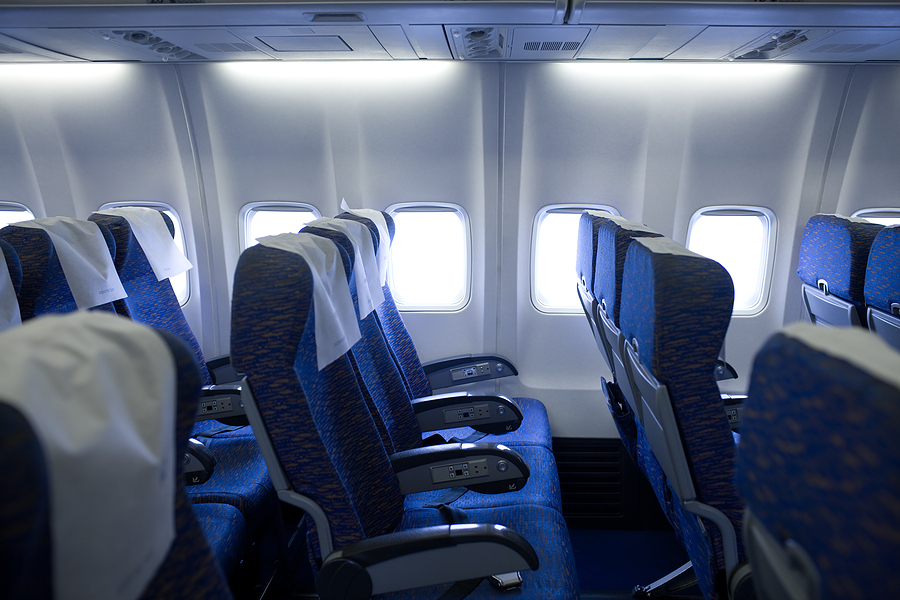
This screenshot has height=600, width=900. Identify the location of windows. (244, 220), (166, 263), (13, 220), (452, 261), (571, 266), (734, 268), (879, 216).